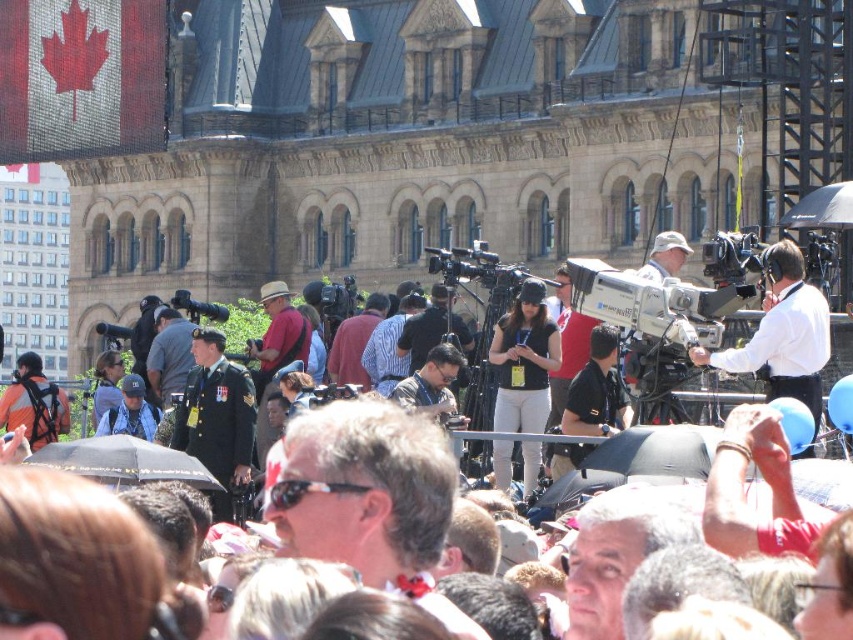
Question: Which point appears closest to the camera in this image?

Choices:
 (A) (216, 312)
 (B) (811, 321)
 (C) (775, 448)
 (D) (523, 428)

Answer: (C)

Question: Is white shirt at right bigger than white cotton pants at center?

Choices:
 (A) yes
 (B) no

Answer: (A)

Question: In this image, where is matte black camera at center located relative to black plastic video camera at center?

Choices:
 (A) left
 (B) right

Answer: (B)

Question: Which of the following is the closest to the observer?

Choices:
 (A) (764, 333)
 (B) (535, 419)

Answer: (A)

Question: Is white cotton pants at center in front of black plastic video camera at center?

Choices:
 (A) yes
 (B) no

Answer: (A)

Question: Which object is farther from the camera taking this photo?

Choices:
 (A) white cotton pants at center
 (B) matte black camera at center
 (C) black plastic video camera at center
 (D) white shirt at right

Answer: (C)